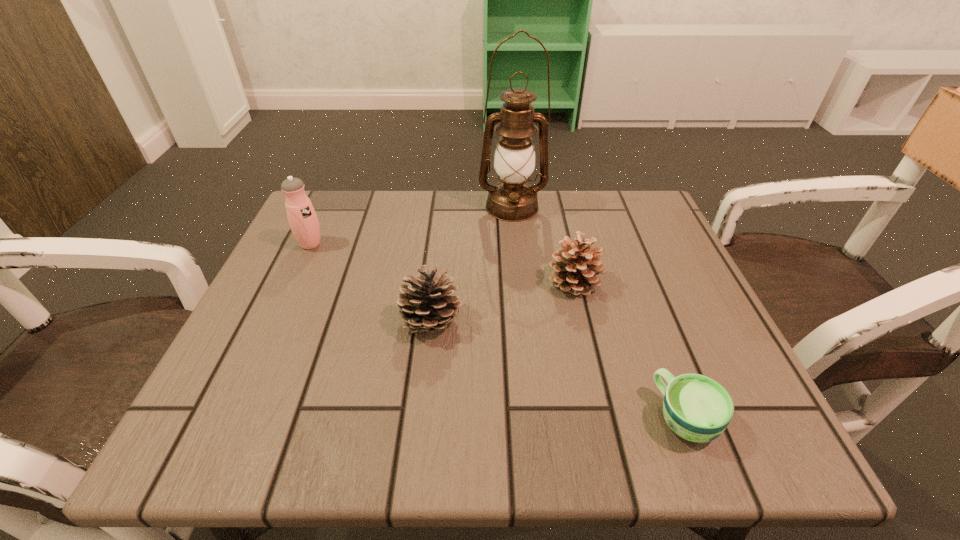
What are the coordinates of `blank space at the far edge of the desktop` in the screenshot? It's located at (588, 236).

The height and width of the screenshot is (540, 960). In the image, there is a desktop. What are the coordinates of `free space at the near edge` in the screenshot? It's located at (302, 454).

The width and height of the screenshot is (960, 540). What are the coordinates of `free space at the left edge` in the screenshot? It's located at (309, 372).

The width and height of the screenshot is (960, 540). I want to click on free region at the right edge of the desktop, so (x=649, y=321).

Locate an element on the screen. This screenshot has height=540, width=960. vacant point at the far left corner is located at coordinates (355, 212).

The width and height of the screenshot is (960, 540). I want to click on vacant region at the near left corner of the desktop, so click(x=255, y=427).

At what (x,y) coordinates should I click in order to perform the action: click on free spot at the far right corner of the desktop. Please return your answer as a coordinate pair (x, y). This screenshot has height=540, width=960. Looking at the image, I should click on (647, 231).

Find the location of a particular element. This screenshot has width=960, height=540. free space at the near right corner of the desktop is located at coordinates (736, 455).

This screenshot has width=960, height=540. Identify the location of free space between the oil lamp and the second object from left to right. (471, 265).

At what (x,y) coordinates should I click in order to perform the action: click on vacant point located between the cup and the left pinecone. Please return your answer as a coordinate pair (x, y). Looking at the image, I should click on (558, 370).